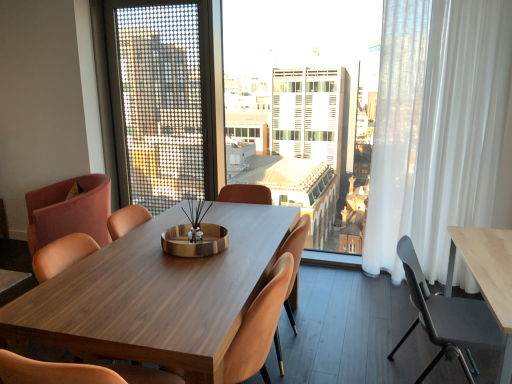
From the picture: Measure the distance between point (x=48, y=365) and camera.

A distance of 1.14 meters exists between point (x=48, y=365) and camera.

Image resolution: width=512 pixels, height=384 pixels. What do you see at coordinates (162, 99) in the screenshot? I see `metallic mesh screen door at upper center` at bounding box center [162, 99].

What do you see at coordinates (69, 211) in the screenshot? I see `pink fabric chair at left, positioned as the fifth chair in right-to-left order` at bounding box center [69, 211].

Locate an element on the screen. The height and width of the screenshot is (384, 512). wooden chair at center, which is the 4th chair from right to left is located at coordinates (62, 255).

Is point (438, 205) positioned in front of point (418, 278)?

No.

Is white sheer curtain at right next to metallic gray chair at right, which is the fifth chair in left-to-right order?

No, white sheer curtain at right is not beside metallic gray chair at right, which is the fifth chair in left-to-right order.

From the image's perspective, is white sheer curtain at right on top of metallic gray chair at right, which is the fifth chair in left-to-right order?

Yes.

Measure the distance from white sheer curtain at right to metallic gray chair at right, which is the fifth chair in left-to-right order.

white sheer curtain at right is 1.30 meters away from metallic gray chair at right, which is the fifth chair in left-to-right order.

Would you say pink fabric chair at left, positioned as the fifth chair in right-to-left order, is part of wooden chair at center, the second chair viewed from the left,'s contents?

A: No, pink fabric chair at left, positioned as the fifth chair in right-to-left order, is located outside of wooden chair at center, the second chair viewed from the left.

Could you measure the distance between wooden chair at center, the second chair viewed from the left, and pink fabric chair at left, positioned as the fifth chair in right-to-left order?

wooden chair at center, the second chair viewed from the left, and pink fabric chair at left, positioned as the fifth chair in right-to-left order, are 4.11 feet apart.

Is wooden chair at center, which is the 4th chair from right to left, next to pink fabric chair at left, positioned as the fifth chair in right-to-left order?

No, wooden chair at center, which is the 4th chair from right to left, is not making contact with pink fabric chair at left, positioned as the fifth chair in right-to-left order.

From the image's perspective, between wooden chair at center, which is the 4th chair from right to left, and pink fabric chair at left, the 1th chair positioned from the left, who is located below?

wooden chair at center, which is the 4th chair from right to left, is shown below in the image.

Based on their positions, is transparent curtain at center located to the left or right of wooden chair at center, the second chair viewed from the left?

transparent curtain at center is positioned on wooden chair at center, the second chair viewed from the left,'s right side.

Considering the relative sizes of transparent curtain at center and wooden chair at center, which is the 4th chair from right to left, in the image provided, is transparent curtain at center shorter than wooden chair at center, which is the 4th chair from right to left,?

No, transparent curtain at center is not shorter than wooden chair at center, which is the 4th chair from right to left.

Which of these two, transparent curtain at center or wooden chair at center, which is the 4th chair from right to left, is wider?

wooden chair at center, which is the 4th chair from right to left.

Consider the image. From the image's perspective, does transparent curtain at center appear higher than metallic mesh screen door at upper center?

Actually, transparent curtain at center appears below metallic mesh screen door at upper center in the image.

Considering the relative sizes of transparent curtain at center and metallic mesh screen door at upper center in the image provided, is transparent curtain at center wider than metallic mesh screen door at upper center?

Yes.

Which is more to the left, transparent curtain at center or metallic mesh screen door at upper center?

Positioned to the left is metallic mesh screen door at upper center.

What's the angular difference between transparent curtain at center and metallic mesh screen door at upper center's facing directions?

transparent curtain at center and metallic mesh screen door at upper center are facing 0.172 degrees away from each other.

From the metallic mesh screen door at upper center, count 5th chairs forward and point to it. Please provide its 2D coordinates.

[(258, 327)]

Is metallic mesh screen door at upper center in contact with matte pink chair at center, the 3th chair from the left?

There is a gap between metallic mesh screen door at upper center and matte pink chair at center, the 3th chair from the left.

Do you think metallic mesh screen door at upper center is within matte pink chair at center, the 3th chair from the left, or outside of it?

metallic mesh screen door at upper center is spatially situated outside matte pink chair at center, the 3th chair from the left.

How much distance is there between metallic mesh screen door at upper center and matte pink chair at center, the 3th chair from the left?

They are 4.20 meters apart.

Is white sheer curtain at right placed right next to metallic mesh screen door at upper center?

There is a gap between white sheer curtain at right and metallic mesh screen door at upper center.

From the image's perspective, between white sheer curtain at right and metallic mesh screen door at upper center, who is located below?

white sheer curtain at right is shown below in the image.

Is white sheer curtain at right oriented away from metallic mesh screen door at upper center?

That's not correct — white sheer curtain at right is not looking away from metallic mesh screen door at upper center.

From a real-world perspective, which object stands above the other?

In real-world perspective, metallic mesh screen door at upper center is above.

Is transparent curtain at center at the back of wooden chair at center, the second chair viewed from the left?

That's not correct — wooden chair at center, the second chair viewed from the left, is not looking away from transparent curtain at center.

Between wooden chair at center, which is the 4th chair from right to left, and transparent curtain at center, which one has smaller size?

Smaller between the two is wooden chair at center, which is the 4th chair from right to left.

Would you say wooden chair at center, which is the 4th chair from right to left, is outside transparent curtain at center?

wooden chair at center, which is the 4th chair from right to left, lies outside transparent curtain at center's area.

Considering the points (60, 270) and (194, 137), which point is in front, point (60, 270) or point (194, 137)?

Point (60, 270)

Where is `curtain located above the metallic gray chair at right, acting as the first chair starting from the right (from a real-world perspective)`? This screenshot has height=384, width=512. curtain located above the metallic gray chair at right, acting as the first chair starting from the right (from a real-world perspective) is located at coordinates (436, 126).

Image resolution: width=512 pixels, height=384 pixels. What are the coordinates of `chair above the wooden chair at center, which is the 4th chair from right to left (from the image's perspective)` in the screenshot? It's located at (69, 211).

Looking at the image, which one is located closer to brown leather chair at center, which is counted as the fourth chair, starting from the left, wooden chair at center, which is the 4th chair from right to left, or matte pink chair at center, which appears as the third chair when viewed from the right?

The object closer to brown leather chair at center, which is counted as the fourth chair, starting from the left, is matte pink chair at center, which appears as the third chair when viewed from the right.

Looking at the image, which one is located further to brown leather chair at center, arranged as the 2th chair when viewed from the right, matte pink chair at center, the 3th chair from the left, or transparent curtain at center?

transparent curtain at center lies further to brown leather chair at center, arranged as the 2th chair when viewed from the right, than the other object.

When comparing their distances from transparent curtain at center, does matte pink chair at center, the 3th chair from the left, or metallic gray chair at right, acting as the first chair starting from the right, seem further?

metallic gray chair at right, acting as the first chair starting from the right, lies further to transparent curtain at center than the other object.

Looking at the image, which one is located closer to metallic gray chair at right, acting as the first chair starting from the right, wooden chair at center, the second chair viewed from the left, or matte pink chair at center, which appears as the third chair when viewed from the right?

Based on the image, matte pink chair at center, which appears as the third chair when viewed from the right, appears to be nearer to metallic gray chair at right, acting as the first chair starting from the right.

From the image, which object appears to be farther from metallic mesh screen door at upper center, transparent curtain at center or pink fabric chair at left, positioned as the fifth chair in right-to-left order?

The object further to metallic mesh screen door at upper center is pink fabric chair at left, positioned as the fifth chair in right-to-left order.

From the image, which object appears to be nearer to wooden chair at center, the second chair viewed from the left, white sheer curtain at right or metallic gray chair at right, acting as the first chair starting from the right?

The object closer to wooden chair at center, the second chair viewed from the left, is metallic gray chair at right, acting as the first chair starting from the right.

Estimate the real-world distances between objects in this image. Which object is further from pink fabric chair at left, the 1th chair positioned from the left, white sheer curtain at right or matte pink chair at center, which appears as the third chair when viewed from the right?

white sheer curtain at right is further to pink fabric chair at left, the 1th chair positioned from the left.

Which object lies nearer to the anchor point brown leather chair at center, arranged as the 2th chair when viewed from the right, wooden chair at center, which is the 4th chair from right to left, or metallic gray chair at right, acting as the first chair starting from the right?

metallic gray chair at right, acting as the first chair starting from the right.

Find the location of a particular element. chair between brown leather chair at center, which is counted as the fourth chair, starting from the left, and white sheer curtain at right, in the horizontal direction is located at coordinates (447, 318).

This screenshot has width=512, height=384. In order to click on window between brown leather chair at center, which is counted as the fourth chair, starting from the left, and metallic mesh screen door at upper center from front to back in this screenshot , I will do `click(274, 109)`.

Locate an element on the screen. This screenshot has height=384, width=512. window between metallic mesh screen door at upper center and white sheer curtain at right is located at coordinates (274, 109).

This screenshot has width=512, height=384. In order to click on curtain located between brown leather chair at center, which is counted as the fourth chair, starting from the left, and transparent curtain at center in the depth direction in this screenshot , I will do `click(436, 126)`.